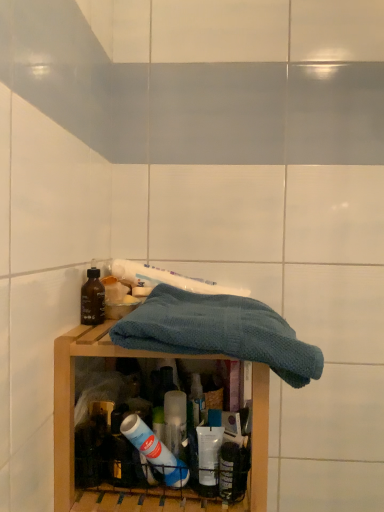
Question: Is wooden shelf at center in front of or behind blue knitted towel at center in the image?

Choices:
 (A) behind
 (B) front

Answer: (A)

Question: From their relative heights in the image, would you say wooden shelf at center is taller or shorter than blue knitted towel at center?

Choices:
 (A) short
 (B) tall

Answer: (B)

Question: Estimate the real-world distances between objects in this image. Which object is farther from the wooden shelf at center?

Choices:
 (A) blue knitted towel at center
 (B) matte brown bottle at left
 (C) white glossy toothpaste at center

Answer: (C)

Question: Considering the real-world distances, which object is farthest from the wooden shelf at center?

Choices:
 (A) blue knitted towel at center
 (B) matte brown bottle at left
 (C) white glossy toothpaste at center

Answer: (C)